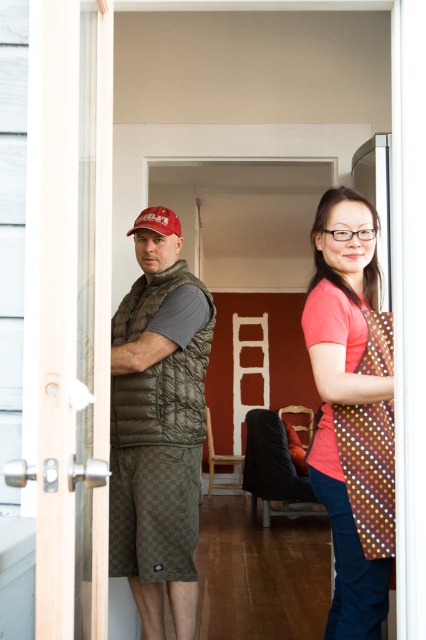
You are a photographer setting up for a portrait. You need to ensure that both the polka dot apron at right and the quilted brown vest at center are clearly visible in the frame. Based on their positions, which object is closer to the camera and might block the other?

The polka dot apron at right is in front of the quilted brown vest at center, so it is closer to the camera and may block the view of the vest.

Looking at this image, you are a delivery person holding a package that requires a signature. You need to hand it to the person closest to the doorway. The doorway is directly behind the quilted brown vest at center and the matte red baseball cap at left. Which person should you give the package to?

The quilted brown vest at center is closer to the doorway than the matte red baseball cap at left, so you should give the package to the person wearing the quilted brown vest at center.

You are an interior designer trying to place a new painting on the wall in the image. The painting must be positioned exactly where the quilted brown vest at center is currently located. What are the coordinates of the point where you should place the painting?

The coordinates for placing the painting should be at point (344, 396), as that is where the quilted brown vest at center is located.